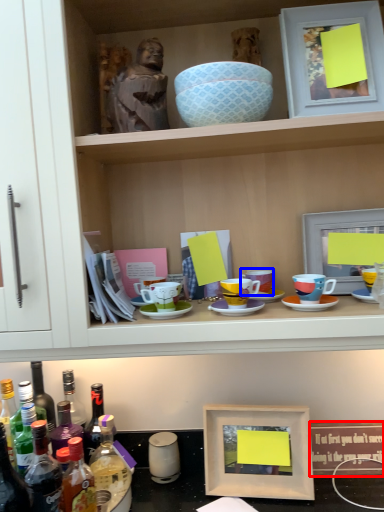
Question: Which of the following is the closest to the observer, picture frame (highlighted by a red box) or coffee cup (highlighted by a blue box)?

Choices:
 (A) picture frame
 (B) coffee cup

Answer: (B)